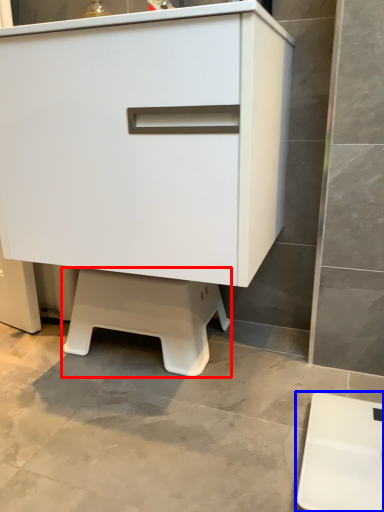
Question: Which object is closer to the camera taking this photo, step stool (highlighted by a red box) or furniture (highlighted by a blue box)?

Choices:
 (A) step stool
 (B) furniture

Answer: (B)